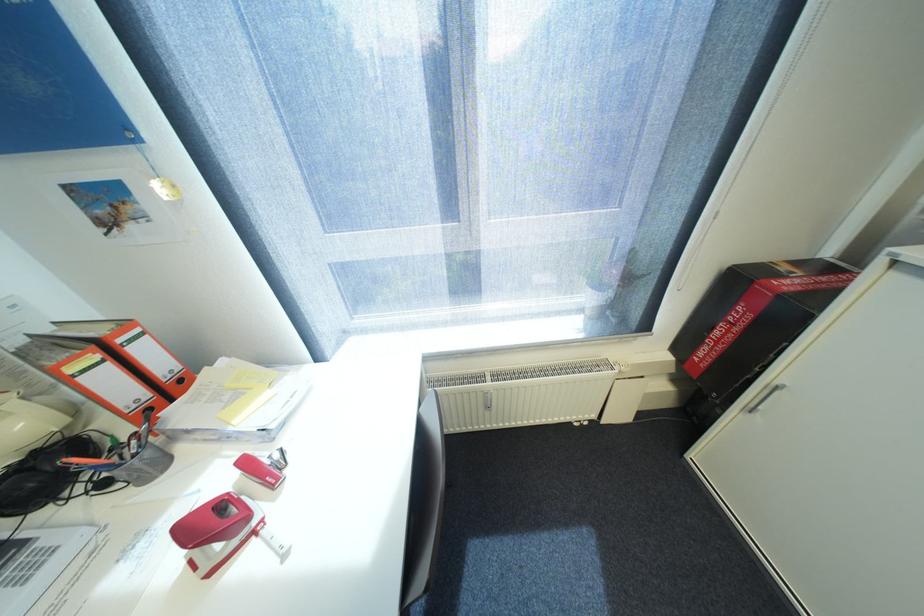
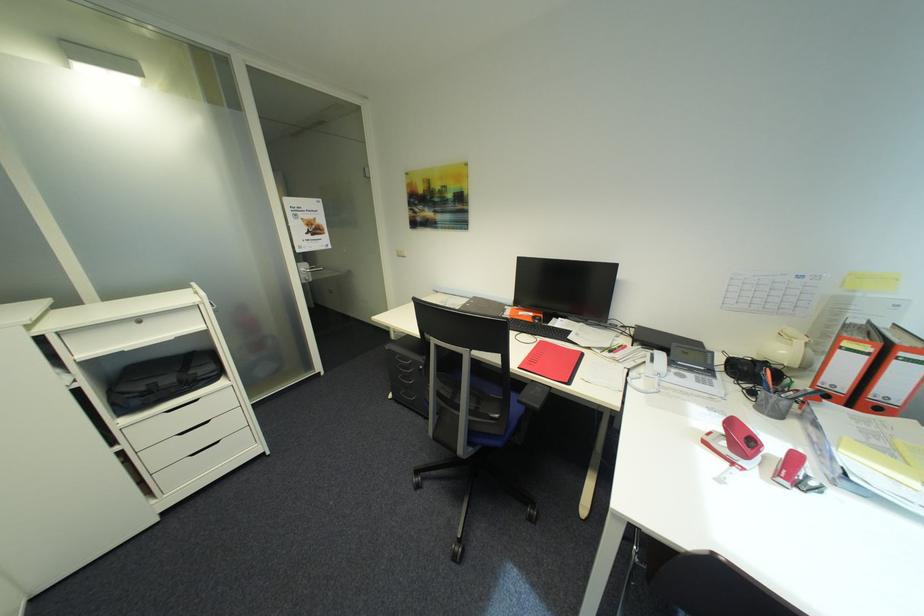
The point at [151,350] is marked in the first image. Where is the corresponding point in the second image?

(912, 371)